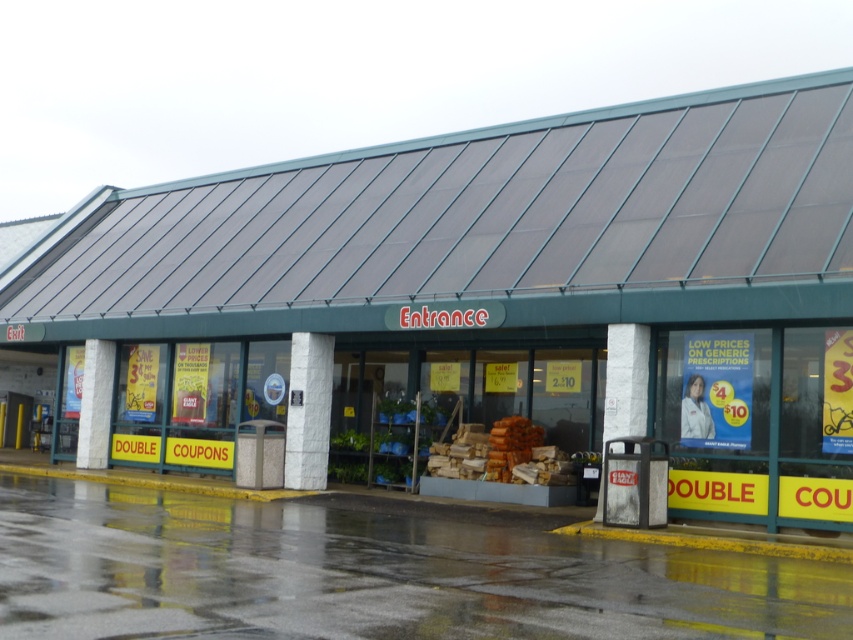
Does green metal entrance at center have a lesser width compared to white textured pillar at center?

No, green metal entrance at center is not thinner than white textured pillar at center.

Describe the element at coordinates (492, 292) in the screenshot. I see `green metal entrance at center` at that location.

Locate an element on the screen. The width and height of the screenshot is (853, 640). green metal entrance at center is located at coordinates 492,292.

Does white stone pillar at center have a lesser width compared to white textured pillar at center?

Incorrect, white stone pillar at center's width is not less than white textured pillar at center's.

Where is `white stone pillar at center`? This screenshot has width=853, height=640. white stone pillar at center is located at coordinates (308, 410).

Is point (331, 381) farther from viewer compared to point (97, 403)?

That is False.

Find the location of a particular element. The width and height of the screenshot is (853, 640). white stone pillar at center is located at coordinates (308, 410).